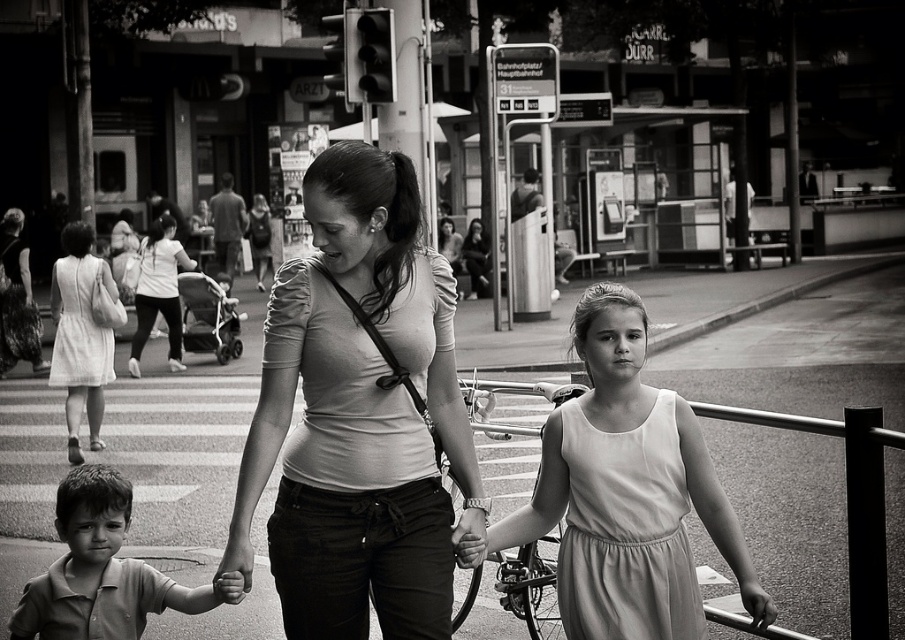
You are a photographer standing at the edge of the pedestrian crossing. You want to take a photo of the light beige fabric dress at center and the smooth cotton shirt at lower left. If your camera can focus on objects within a 5 feet range, will both subjects be in focus?

The light beige fabric dress at center is 4.69 feet from the smooth cotton shirt at lower left. Since the distance between them is within the 5 feet range, both subjects will be in focus.

You are a photographer trying to focus on the matte white shirt at center and the light beige fabric dress at center in the image. Which one is closer to the camera?

The matte white shirt at center is in front of the light beige fabric dress at center, so it is closer to the camera.